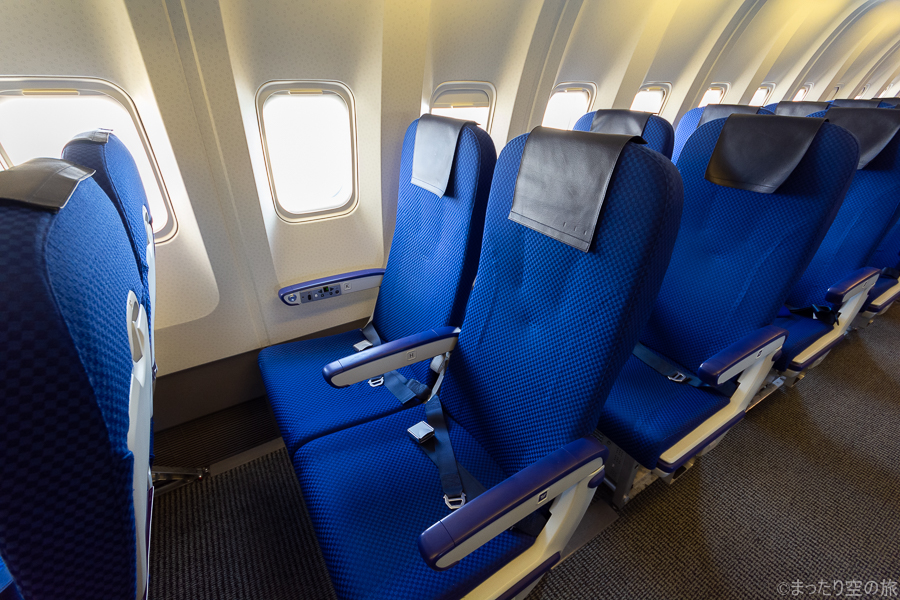
This screenshot has height=600, width=900. I want to click on bulkhead divider, so click(187, 62), click(401, 53), click(546, 65), click(644, 57), click(716, 56), click(770, 54), click(808, 61), click(842, 63), click(874, 66), click(889, 78).